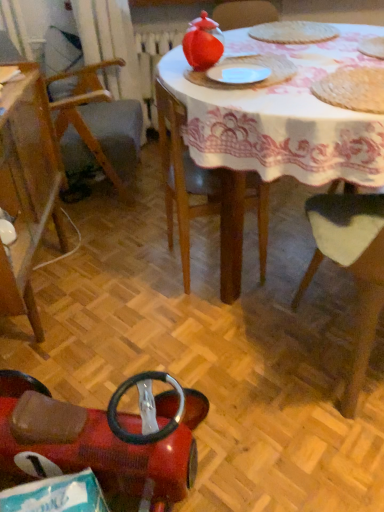
Question: From a real-world perspective, is wooden chair at lower right, the 3th chair in the left-to-right sequence, on top of white matte paper plate at center?

Choices:
 (A) no
 (B) yes

Answer: (A)

Question: Does wooden chair at lower right, the 1th chair positioned from the right, have a larger size compared to white matte paper plate at center?

Choices:
 (A) yes
 (B) no

Answer: (A)

Question: Is the position of wooden chair at lower right, the 3th chair in the left-to-right sequence, less distant than that of white matte paper plate at center?

Choices:
 (A) no
 (B) yes

Answer: (B)

Question: Can you confirm if wooden chair at lower right, the 3th chair in the left-to-right sequence, is wider than white matte paper plate at center?

Choices:
 (A) no
 (B) yes

Answer: (B)

Question: Could you tell me if wooden chair at lower right, the 1th chair positioned from the right, is turned towards white matte paper plate at center?

Choices:
 (A) no
 (B) yes

Answer: (A)

Question: Would you say wooden chair at lower right, the 3th chair in the left-to-right sequence, is to the left or to the right of white lace tablecloth at upper center in the picture?

Choices:
 (A) right
 (B) left

Answer: (A)

Question: From the image's perspective, is wooden chair at lower right, the 3th chair in the left-to-right sequence, located above or below white lace tablecloth at upper center?

Choices:
 (A) below
 (B) above

Answer: (A)

Question: Is wooden chair at lower right, the 3th chair in the left-to-right sequence, bigger or smaller than white lace tablecloth at upper center?

Choices:
 (A) big
 (B) small

Answer: (B)

Question: Considering their positions, is wooden chair at lower right, the 3th chair in the left-to-right sequence, located in front of or behind white lace tablecloth at upper center?

Choices:
 (A) front
 (B) behind

Answer: (A)

Question: Is white matte paper plate at center in front of or behind rubberized red toy car at lower left, the second chair viewed from the left, in the image?

Choices:
 (A) behind
 (B) front

Answer: (A)

Question: Considering the positions of point (246, 66) and point (54, 468), is point (246, 66) closer or farther from the camera than point (54, 468)?

Choices:
 (A) farther
 (B) closer

Answer: (A)

Question: Would you say white matte paper plate at center is to the left or to the right of rubberized red toy car at lower left, the 2th chair positioned from the right, in the picture?

Choices:
 (A) left
 (B) right

Answer: (B)

Question: In terms of height, does white matte paper plate at center look taller or shorter compared to rubberized red toy car at lower left, the second chair viewed from the left?

Choices:
 (A) tall
 (B) short

Answer: (B)

Question: From a real-world perspective, is rubberized red toy car at lower left, the second chair viewed from the left, positioned above or below white lace tablecloth at upper center?

Choices:
 (A) above
 (B) below

Answer: (B)

Question: Is rubberized red toy car at lower left, the 2th chair positioned from the right, spatially inside white lace tablecloth at upper center, or outside of it?

Choices:
 (A) outside
 (B) inside

Answer: (A)